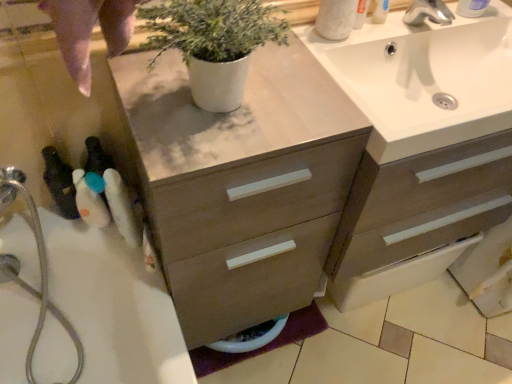
Question: Is white plastic bottle at lower left, which is the second toiletry from bottom to top, to the right of white plastic soap dispenser at upper right, the fourth toiletry when ordered from bottom to top, from the viewer's perspective?

Choices:
 (A) yes
 (B) no

Answer: (B)

Question: Would you say white plastic bottle at lower left, which ranks as the third toiletry in right-to-left order, is outside white plastic soap dispenser at upper right, which appears as the 1th toiletry when viewed from the right?

Choices:
 (A) no
 (B) yes

Answer: (B)

Question: From the image's perspective, is white plastic bottle at lower left, which ranks as the third toiletry in right-to-left order, beneath white plastic soap dispenser at upper right, which appears as the 1th toiletry when viewed from the right?

Choices:
 (A) no
 (B) yes

Answer: (B)

Question: Are white plastic bottle at lower left, which is the second toiletry from bottom to top, and white plastic soap dispenser at upper right, which appears as the 1th toiletry when viewed from the right, located far from each other?

Choices:
 (A) yes
 (B) no

Answer: (B)

Question: Is white plastic soap dispenser at upper right, positioned as the 1th toiletry in top-to-bottom order, inside white plastic bottle at lower left, arranged as the third toiletry when viewed from the top?

Choices:
 (A) yes
 (B) no

Answer: (B)

Question: Considering the relative sizes of white plastic bottle at lower left, arranged as the third toiletry when viewed from the top, and white plastic soap dispenser at upper right, the fourth toiletry when ordered from bottom to top, in the image provided, is white plastic bottle at lower left, arranged as the third toiletry when viewed from the top, shorter than white plastic soap dispenser at upper right, the fourth toiletry when ordered from bottom to top,?

Choices:
 (A) yes
 (B) no

Answer: (A)

Question: Can you confirm if white glossy sink at upper right is taller than white plastic soap dispenser at upper right, positioned as the 1th toiletry in top-to-bottom order?

Choices:
 (A) no
 (B) yes

Answer: (A)

Question: Considering the relative sizes of white glossy sink at upper right and white plastic soap dispenser at upper right, positioned as the 1th toiletry in top-to-bottom order, in the image provided, is white glossy sink at upper right wider than white plastic soap dispenser at upper right, positioned as the 1th toiletry in top-to-bottom order,?

Choices:
 (A) yes
 (B) no

Answer: (A)

Question: From a real-world perspective, is white glossy sink at upper right beneath white plastic soap dispenser at upper right, the fourth toiletry from the left?

Choices:
 (A) no
 (B) yes

Answer: (B)

Question: Does white glossy sink at upper right lie in front of white plastic soap dispenser at upper right, positioned as the 1th toiletry in top-to-bottom order?

Choices:
 (A) yes
 (B) no

Answer: (A)

Question: Does white glossy sink at upper right have a larger size compared to white plastic soap dispenser at upper right, which appears as the 1th toiletry when viewed from the right?

Choices:
 (A) yes
 (B) no

Answer: (A)

Question: Can we say white glossy sink at upper right lies outside white plastic soap dispenser at upper right, positioned as the 1th toiletry in top-to-bottom order?

Choices:
 (A) yes
 (B) no

Answer: (A)

Question: Considering the relative positions of white plastic bottle at lower left, which is counted as the 2th toiletry, starting from the left, and white matte toilet paper at upper right in the image provided, is white plastic bottle at lower left, which is counted as the 2th toiletry, starting from the left, behind white matte toilet paper at upper right?

Choices:
 (A) yes
 (B) no

Answer: (A)